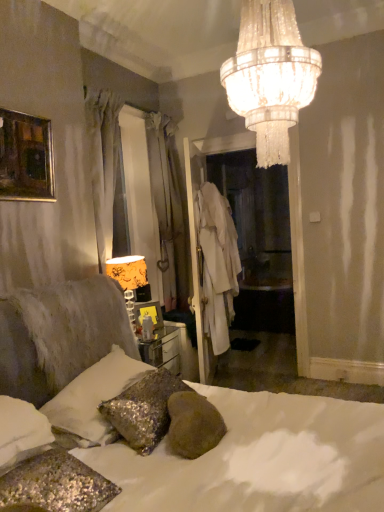
Question: Is crystal chandelier at upper center far away from white sequined pillow at lower left, which ranks as the 3th pillow in front-to-back order?

Choices:
 (A) yes
 (B) no

Answer: (A)

Question: Is crystal chandelier at upper center touching white sequined pillow at lower left, which is the 1th pillow in back-to-front order?

Choices:
 (A) yes
 (B) no

Answer: (B)

Question: Is crystal chandelier at upper center turned away from white sequined pillow at lower left, which is the 1th pillow in back-to-front order?

Choices:
 (A) yes
 (B) no

Answer: (B)

Question: Is crystal chandelier at upper center smaller than white sequined pillow at lower left, which ranks as the 3th pillow in front-to-back order?

Choices:
 (A) yes
 (B) no

Answer: (A)

Question: Is crystal chandelier at upper center located outside white sequined pillow at lower left, which is the 1th pillow in back-to-front order?

Choices:
 (A) yes
 (B) no

Answer: (A)

Question: Considering their positions, is orange fabric lampshade at left located in front of or behind sparkly silver pillow at lower left, the second pillow positioned from the back?

Choices:
 (A) behind
 (B) front

Answer: (A)

Question: Considering the positions of point (129, 271) and point (94, 419), is point (129, 271) closer or farther from the camera than point (94, 419)?

Choices:
 (A) closer
 (B) farther

Answer: (B)

Question: From the image's perspective, is orange fabric lampshade at left located above or below sparkly silver pillow at lower left, which is the 2th pillow from front to back?

Choices:
 (A) above
 (B) below

Answer: (A)

Question: In the image, is orange fabric lampshade at left on the left side or the right side of sparkly silver pillow at lower left, which is the 2th pillow from front to back?

Choices:
 (A) left
 (B) right

Answer: (A)

Question: From their relative heights in the image, would you say gold-framed painting at upper left, the first picture frame in the left-to-right sequence, is taller or shorter than orange fabric lampshade at left?

Choices:
 (A) short
 (B) tall

Answer: (A)

Question: From a real-world perspective, is gold-framed painting at upper left, the first picture frame in the left-to-right sequence, above or below orange fabric lampshade at left?

Choices:
 (A) below
 (B) above

Answer: (B)

Question: Considering the positions of point (1, 186) and point (137, 283), is point (1, 186) closer or farther from the camera than point (137, 283)?

Choices:
 (A) closer
 (B) farther

Answer: (A)

Question: Considering the positions of gold-framed painting at upper left, acting as the first picture frame starting from the top, and orange fabric lampshade at left in the image, is gold-framed painting at upper left, acting as the first picture frame starting from the top, bigger or smaller than orange fabric lampshade at left?

Choices:
 (A) big
 (B) small

Answer: (B)

Question: In the image, is sparkly silver pillow at lower left, which is the 2th pillow from front to back, on the left side or the right side of white cotton robe at center?

Choices:
 (A) left
 (B) right

Answer: (A)

Question: Considering the positions of sparkly silver pillow at lower left, the second pillow positioned from the back, and white cotton robe at center in the image, is sparkly silver pillow at lower left, the second pillow positioned from the back, taller or shorter than white cotton robe at center?

Choices:
 (A) short
 (B) tall

Answer: (A)